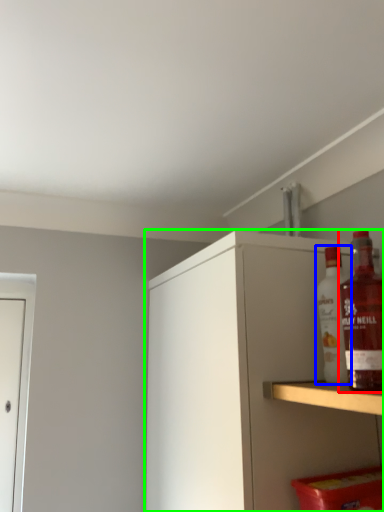
Question: Which is farther away from bottle (highlighted by a red box)? bottle (highlighted by a blue box) or cabinetry (highlighted by a green box)?

Choices:
 (A) bottle
 (B) cabinetry

Answer: (B)